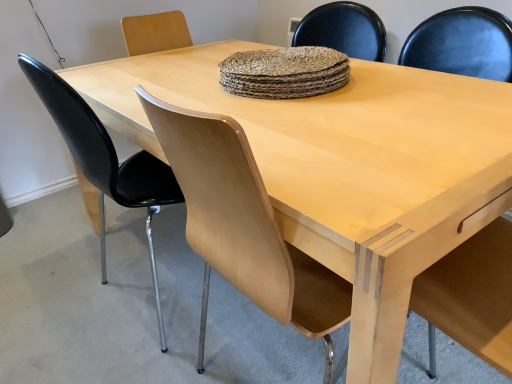
Describe the element at coordinates (471, 295) in the screenshot. This screenshot has width=512, height=384. I see `light wood armchair at right` at that location.

Where is `light wood armchair at right`? The image size is (512, 384). light wood armchair at right is located at coordinates (471, 295).

Based on the photo, measure the distance between point (x=65, y=94) and camera.

The distance of point (x=65, y=94) from camera is 92.80 centimeters.

Image resolution: width=512 pixels, height=384 pixels. I want to click on light wood armchair at right, so click(x=471, y=295).

Does light wood chair at center, the second chair in the left-to-right sequence, have a lesser width compared to black glossy chair at left, the 2th chair when ordered from right to left?

In fact, light wood chair at center, the second chair in the left-to-right sequence, might be wider than black glossy chair at left, the 2th chair when ordered from right to left.

Would you say light wood chair at center, the second chair in the left-to-right sequence, is to the left or to the right of black glossy chair at left, the 2th chair when ordered from right to left, in the picture?

Based on their positions, light wood chair at center, the second chair in the left-to-right sequence, is located to the right of black glossy chair at left, the 2th chair when ordered from right to left.

At what (x,y) coordinates should I click in order to perform the action: click on chair that is on the right side of black glossy chair at left, the 1th chair when ordered from left to right. Please return your answer as a coordinate pair (x, y). The width and height of the screenshot is (512, 384). Looking at the image, I should click on (244, 227).

Considering the positions of objects light wood armchair at right and black glossy chair at left, the 2th chair when ordered from right to left, in the image provided, who is in front, light wood armchair at right or black glossy chair at left, the 2th chair when ordered from right to left,?

light wood armchair at right is in front.

Does point (490, 48) come behind point (60, 103)?

Yes.

Would you say light wood armchair at right is to the left or to the right of black glossy chair at left, the 2th chair when ordered from right to left, in the picture?

In the image, light wood armchair at right appears on the right side of black glossy chair at left, the 2th chair when ordered from right to left.

Is light wood armchair at right not inside black glossy chair at left, the 1th chair when ordered from left to right?

light wood armchair at right is positioned outside black glossy chair at left, the 1th chair when ordered from left to right.

In the scene shown: How different are the orientations of black glossy chair at left, the 2th chair when ordered from right to left, and light wood armchair at right in degrees?

black glossy chair at left, the 2th chair when ordered from right to left, and light wood armchair at right are facing 90.5 degrees away from each other.

From the image's perspective, which is below, black glossy chair at left, the 1th chair when ordered from left to right, or light wood armchair at right?

From the image's view, light wood armchair at right is below.

Does black glossy chair at left, the 1th chair when ordered from left to right, have a greater height compared to light wood armchair at right?

In fact, black glossy chair at left, the 1th chair when ordered from left to right, may be shorter than light wood armchair at right.

Which is closer, (156, 193) or (511, 80)?

Point (156, 193) is positioned closer to the camera compared to point (511, 80).

Considering the relative sizes of black glossy chair at left, the 2th chair when ordered from right to left, and light wood chair at center, the second chair in the left-to-right sequence, in the image provided, is black glossy chair at left, the 2th chair when ordered from right to left, thinner than light wood chair at center, the second chair in the left-to-right sequence,?

Yes, black glossy chair at left, the 2th chair when ordered from right to left, is thinner than light wood chair at center, the second chair in the left-to-right sequence.

Does black glossy chair at left, the 2th chair when ordered from right to left, turn towards light wood chair at center, the 1th chair when ordered from right to left?

No, black glossy chair at left, the 2th chair when ordered from right to left, is not facing towards light wood chair at center, the 1th chair when ordered from right to left.

From a real-world perspective, is black glossy chair at left, the 2th chair when ordered from right to left, positioned under light wood chair at center, the 1th chair when ordered from right to left, based on gravity?

Actually, black glossy chair at left, the 2th chair when ordered from right to left, is physically above light wood chair at center, the 1th chair when ordered from right to left, in the real world.

Considering the relative sizes of black glossy chair at left, the 1th chair when ordered from left to right, and light wood chair at center, the 1th chair when ordered from right to left, in the image provided, is black glossy chair at left, the 1th chair when ordered from left to right, taller than light wood chair at center, the 1th chair when ordered from right to left,?

No.

Who is taller, light wood chair at center, the second chair in the left-to-right sequence, or light wood armchair at right?

Standing taller between the two is light wood chair at center, the second chair in the left-to-right sequence.

From a real-world perspective, who is located lower, light wood chair at center, the second chair in the left-to-right sequence, or light wood armchair at right?

From a 3D spatial view, light wood armchair at right is below.

Measure the distance between light wood chair at center, the 1th chair when ordered from right to left, and light wood armchair at right.

99.20 centimeters.

Is light wood chair at center, the 1th chair when ordered from right to left, placed right next to light wood armchair at right?

light wood chair at center, the 1th chair when ordered from right to left, and light wood armchair at right are not in contact.

From a real-world perspective, which is physically above, light wood armchair at right or light wood chair at center, the second chair in the left-to-right sequence?

light wood chair at center, the second chair in the left-to-right sequence.

Considering the positions of objects light wood armchair at right and light wood chair at center, the 1th chair when ordered from right to left, in the image provided, who is more to the left, light wood armchair at right or light wood chair at center, the 1th chair when ordered from right to left,?

light wood chair at center, the 1th chair when ordered from right to left, is more to the left.

From the picture: Relative to light wood chair at center, the 1th chair when ordered from right to left, is light wood armchair at right in front or behind?

In the image, light wood armchair at right appears in front of light wood chair at center, the 1th chair when ordered from right to left.

Does light wood armchair at right have a lesser width compared to light wood chair at center, the 1th chair when ordered from right to left?

Yes.

Locate an element on the screen. The width and height of the screenshot is (512, 384). chair on the right of black glossy chair at left, the 2th chair when ordered from right to left is located at coordinates (244, 227).

Starting from the light wood armchair at right, which chair is the 2nd one to the left? Please provide its 2D coordinates.

[(105, 160)]

Based on the photo, considering their positions, is black glossy chair at left, the 1th chair when ordered from left to right, positioned further to light wood armchair at right than light wood chair at center, the second chair in the left-to-right sequence?

black glossy chair at left, the 1th chair when ordered from left to right, lies further to light wood armchair at right than the other object.

Estimate the real-world distances between objects in this image. Which object is closer to black glossy chair at left, the 2th chair when ordered from right to left, light wood chair at center, the second chair in the left-to-right sequence, or light wood armchair at right?

Based on the image, light wood chair at center, the second chair in the left-to-right sequence, appears to be nearer to black glossy chair at left, the 2th chair when ordered from right to left.

Considering their positions, is light wood armchair at right positioned closer to black glossy chair at left, the 2th chair when ordered from right to left, than light wood chair at center, the 1th chair when ordered from right to left?

Based on the image, light wood chair at center, the 1th chair when ordered from right to left, appears to be nearer to black glossy chair at left, the 2th chair when ordered from right to left.

Estimate the real-world distances between objects in this image. Which object is closer to light wood chair at center, the 1th chair when ordered from right to left, light wood armchair at right or black glossy chair at left, the 2th chair when ordered from right to left?

black glossy chair at left, the 2th chair when ordered from right to left, is closer to light wood chair at center, the 1th chair when ordered from right to left.

Which object lies nearer to the anchor point light wood armchair at right, light wood chair at center, the second chair in the left-to-right sequence, or black glossy chair at left, the 2th chair when ordered from right to left?

light wood chair at center, the second chair in the left-to-right sequence, lies closer to light wood armchair at right than the other object.

Which object lies further to the anchor point light wood chair at center, the second chair in the left-to-right sequence, black glossy chair at left, the 1th chair when ordered from left to right, or light wood armchair at right?

Based on the image, light wood armchair at right appears to be further to light wood chair at center, the second chair in the left-to-right sequence.

What are the coordinates of `chair between black glossy chair at left, the 2th chair when ordered from right to left, and light wood armchair at right from left to right` in the screenshot? It's located at (244, 227).